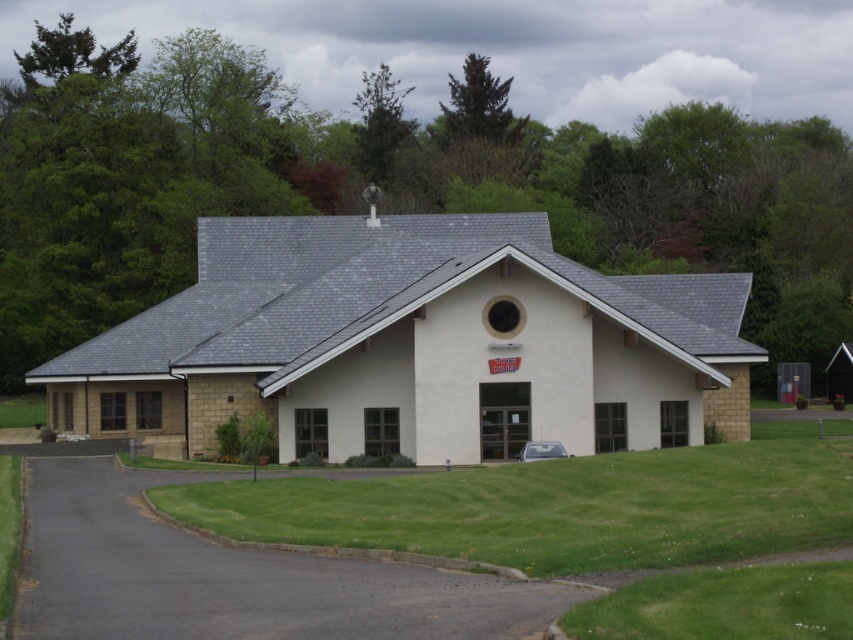
Question: Can you confirm if green grass at center is positioned below black asphalt driveway at lower left?

Choices:
 (A) yes
 (B) no

Answer: (B)

Question: Does white smooth chapel at center appear over black asphalt driveway at lower left?

Choices:
 (A) no
 (B) yes

Answer: (B)

Question: Which object is positioned closest to the black asphalt driveway at lower left?

Choices:
 (A) white smooth chapel at center
 (B) green grass at center

Answer: (B)

Question: Which point is closer to the camera?

Choices:
 (A) black asphalt driveway at lower left
 (B) white smooth chapel at center
 (C) green grass at center

Answer: (C)

Question: Does green grass at center appear on the left side of black asphalt driveway at lower left?

Choices:
 (A) no
 (B) yes

Answer: (A)

Question: Which of the following is the farthest from the observer?

Choices:
 (A) white smooth chapel at center
 (B) green grass at center
 (C) black asphalt driveway at lower left

Answer: (A)